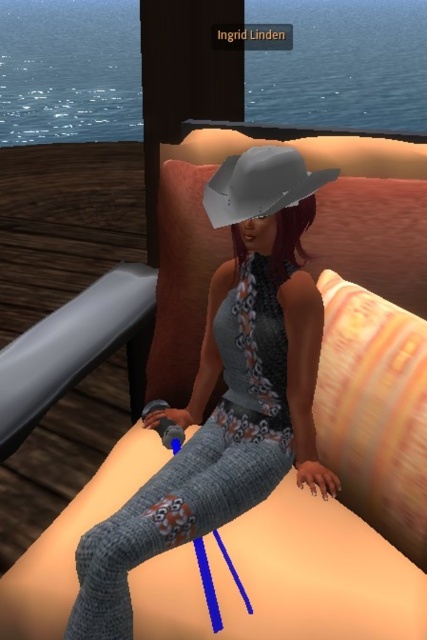
Is knitted gray pants at center further to the viewer compared to gray matte cowboy hat at center?

No, it is not.

Does knitted gray pants at center have a lesser width compared to gray matte cowboy hat at center?

In fact, knitted gray pants at center might be wider than gray matte cowboy hat at center.

Is point (93, 557) less distant than point (301, 164)?

Yes, point (93, 557) is in front of point (301, 164).

You are a GUI agent. You are given a task and a screenshot of the screen. Output one action in this format:
    pyautogui.click(x=<x>, y=<y>)
    Task: Click on the knitted gray pants at center
    This screenshot has height=640, width=427.
    Given the screenshot: What is the action you would take?
    pyautogui.click(x=228, y=388)

From the picture: Can you confirm if striped fabric pillow at right is positioned below gray matte cowboy hat at center?

Indeed, striped fabric pillow at right is positioned under gray matte cowboy hat at center.

Is point (406, 378) positioned before point (274, 177)?

Yes, it is in front of point (274, 177).

This screenshot has height=640, width=427. I want to click on striped fabric pillow at right, so click(374, 410).

Who is taller, knitted gray pants at center or striped fabric pillow at right?

Standing taller between the two is knitted gray pants at center.

Between point (213, 179) and point (328, 301), which one is positioned behind?

Point (328, 301)

Identify the location of knitted gray pants at center. (228, 388).